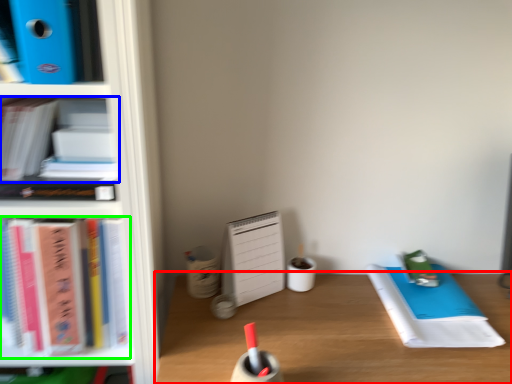
Question: Considering the real-world distances, which object is closest to desk (highlighted by a red box)? book (highlighted by a blue box) or book (highlighted by a green box).

Choices:
 (A) book
 (B) book

Answer: (B)